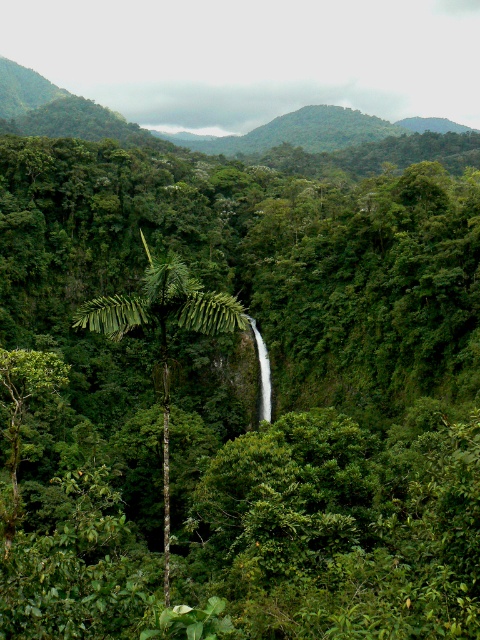
Is green leafy mountain at upper center further to camera compared to green leafy palm tree at center?

Yes, green leafy mountain at upper center is behind green leafy palm tree at center.

Looking at this image, is green leafy mountain at upper center wider than green leafy palm tree at center?

Correct, the width of green leafy mountain at upper center exceeds that of green leafy palm tree at center.

Between point (48, 112) and point (179, 305), which one is positioned in front?

Point (179, 305)

Locate an element on the screen. green leafy mountain at upper center is located at coordinates (188, 132).